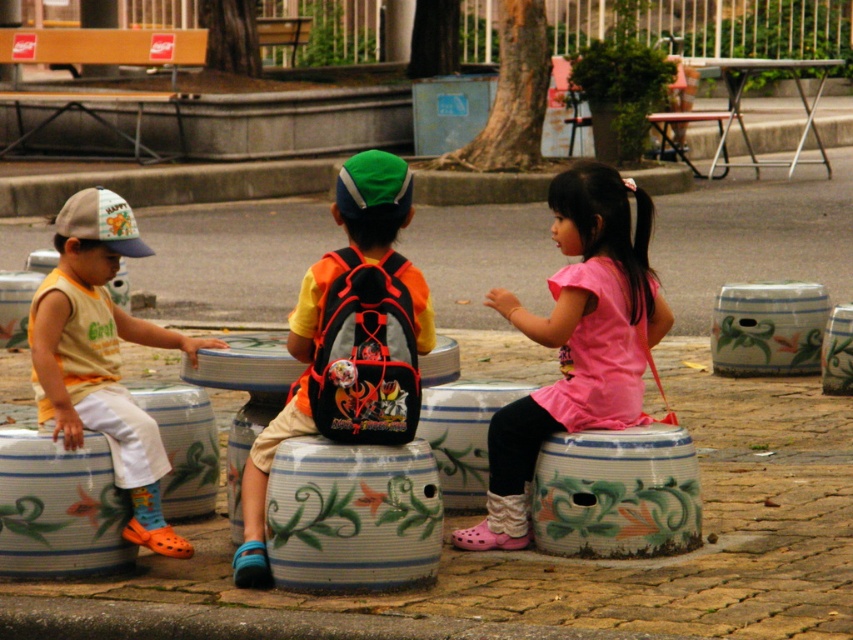
Question: Is matte orange backpack at center to the left of pink fabric dress at center from the viewer's perspective?

Choices:
 (A) yes
 (B) no

Answer: (A)

Question: Which is nearer to the pink fabric dress at center?

Choices:
 (A) matte orange backpack at center
 (B) matte yellow tank top at left

Answer: (A)

Question: Among these objects, which one is farthest from the camera?

Choices:
 (A) matte orange backpack at center
 (B) pink fabric dress at center
 (C) matte yellow tank top at left

Answer: (B)

Question: Is matte orange backpack at center to the left of matte yellow tank top at left from the viewer's perspective?

Choices:
 (A) no
 (B) yes

Answer: (A)

Question: Among these objects, which one is nearest to the camera?

Choices:
 (A) matte orange backpack at center
 (B) matte yellow tank top at left

Answer: (A)

Question: Does matte orange backpack at center come behind pink fabric dress at center?

Choices:
 (A) yes
 (B) no

Answer: (B)